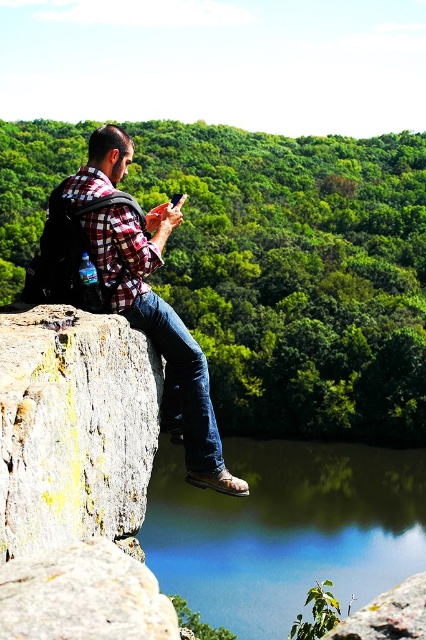
Based on the photo, who is higher up, yellowish rock at left or plaid fabric shirt at left?

plaid fabric shirt at left is higher up.

Image resolution: width=426 pixels, height=640 pixels. Describe the element at coordinates (74, 428) in the screenshot. I see `yellowish rock at left` at that location.

Who is more forward, (x=141, y=381) or (x=233, y=492)?

Point (x=141, y=381) is more forward.

The image size is (426, 640). What are the coordinates of `yellowish rock at left` in the screenshot? It's located at (74, 428).

Is green smooth water at lower center smaller than plaid fabric shirt at left?

Actually, green smooth water at lower center might be larger than plaid fabric shirt at left.

Does green smooth water at lower center appear on the left side of plaid fabric shirt at left?

In fact, green smooth water at lower center is to the right of plaid fabric shirt at left.

What do you see at coordinates (285, 529) in the screenshot? The image size is (426, 640). I see `green smooth water at lower center` at bounding box center [285, 529].

Where is `green smooth water at lower center`? The image size is (426, 640). green smooth water at lower center is located at coordinates point(285,529).

Who is more distant from viewer, (158,557) or (155,433)?

The point (158,557) is more distant.

Find the location of a particular element. green smooth water at lower center is located at coordinates (285, 529).